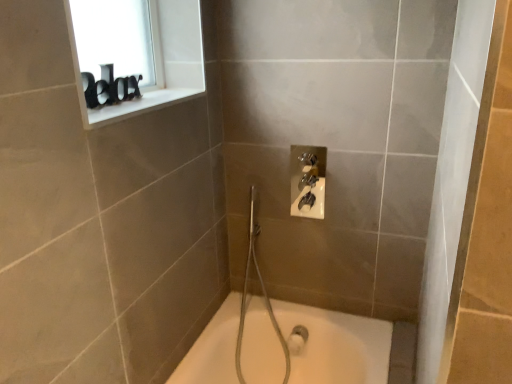
Question: Does white ceramic at upper left have a smaller size compared to black plastic letters at upper left?

Choices:
 (A) yes
 (B) no

Answer: (A)

Question: Is white ceramic at upper left further to the viewer compared to black plastic letters at upper left?

Choices:
 (A) yes
 (B) no

Answer: (B)

Question: Does white ceramic at upper left have a lesser width compared to black plastic letters at upper left?

Choices:
 (A) no
 (B) yes

Answer: (A)

Question: Does white ceramic at upper left turn towards black plastic letters at upper left?

Choices:
 (A) yes
 (B) no

Answer: (B)

Question: Is white ceramic at upper left wider than black plastic letters at upper left?

Choices:
 (A) yes
 (B) no

Answer: (A)

Question: Is white ceramic at upper left at the right side of black plastic letters at upper left?

Choices:
 (A) no
 (B) yes

Answer: (B)

Question: Does black plastic letters at upper left have a greater width compared to white ceramic at upper left?

Choices:
 (A) yes
 (B) no

Answer: (B)

Question: Is black plastic letters at upper left bigger than white ceramic at upper left?

Choices:
 (A) no
 (B) yes

Answer: (B)

Question: Can you confirm if black plastic letters at upper left is thinner than white ceramic at upper left?

Choices:
 (A) no
 (B) yes

Answer: (B)

Question: Can you confirm if black plastic letters at upper left is smaller than white ceramic at upper left?

Choices:
 (A) no
 (B) yes

Answer: (A)

Question: Is black plastic letters at upper left looking in the opposite direction of white ceramic at upper left?

Choices:
 (A) no
 (B) yes

Answer: (A)

Question: Considering the relative sizes of black plastic letters at upper left and white ceramic at upper left in the image provided, is black plastic letters at upper left taller than white ceramic at upper left?

Choices:
 (A) yes
 (B) no

Answer: (A)

Question: Is white ceramic at upper left to the left or to the right of black plastic letters at upper left in the image?

Choices:
 (A) left
 (B) right

Answer: (B)